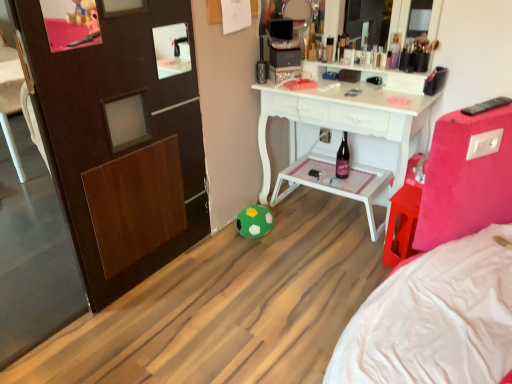
Question: Can you confirm if metallic silver toiletry at center, the first toiletry from the left, is thinner than metallic silver toiletries at upper center, which appears as the 2th toiletry when viewed from the left?

Choices:
 (A) yes
 (B) no

Answer: (A)

Question: Is metallic silver toiletry at center, the first toiletry from the left, facing away from metallic silver toiletries at upper center, placed as the 1th toiletry when sorted from right to left?

Choices:
 (A) no
 (B) yes

Answer: (A)

Question: Considering the relative sizes of metallic silver toiletry at center, acting as the second toiletry starting from the right, and metallic silver toiletries at upper center, which appears as the 2th toiletry when viewed from the left, in the image provided, is metallic silver toiletry at center, acting as the second toiletry starting from the right, smaller than metallic silver toiletries at upper center, which appears as the 2th toiletry when viewed from the left,?

Choices:
 (A) yes
 (B) no

Answer: (A)

Question: From the image's perspective, is metallic silver toiletry at center, the first toiletry from the left, on top of metallic silver toiletries at upper center, which appears as the 2th toiletry when viewed from the left?

Choices:
 (A) no
 (B) yes

Answer: (A)

Question: Is metallic silver toiletries at upper center, which appears as the 2th toiletry when viewed from the left, surrounded by metallic silver toiletry at center, acting as the second toiletry starting from the right?

Choices:
 (A) yes
 (B) no

Answer: (B)

Question: Is black plastic remote control at upper right bigger or smaller than dark glass bottle at center?

Choices:
 (A) small
 (B) big

Answer: (A)

Question: From their relative heights in the image, would you say black plastic remote control at upper right is taller or shorter than dark glass bottle at center?

Choices:
 (A) short
 (B) tall

Answer: (A)

Question: From a real-world perspective, is black plastic remote control at upper right positioned above or below dark glass bottle at center?

Choices:
 (A) below
 (B) above

Answer: (B)

Question: Is point (503, 104) closer or farther from the camera than point (340, 153)?

Choices:
 (A) closer
 (B) farther

Answer: (A)

Question: Based on their positions, is metallic silver toiletry at center, acting as the second toiletry starting from the right, located to the left or right of green felt ball at lower center?

Choices:
 (A) left
 (B) right

Answer: (B)

Question: Is metallic silver toiletry at center, acting as the second toiletry starting from the right, inside or outside of green felt ball at lower center?

Choices:
 (A) inside
 (B) outside

Answer: (B)

Question: Relative to green felt ball at lower center, is metallic silver toiletry at center, the first toiletry from the left, in front or behind?

Choices:
 (A) front
 (B) behind

Answer: (B)

Question: From the image's perspective, is metallic silver toiletry at center, the first toiletry from the left, located above or below green felt ball at lower center?

Choices:
 (A) below
 (B) above

Answer: (B)

Question: In terms of height, does black plastic remote control at upper right look taller or shorter compared to white plastic tray at center?

Choices:
 (A) short
 (B) tall

Answer: (A)

Question: From the image's perspective, relative to white plastic tray at center, is black plastic remote control at upper right above or below?

Choices:
 (A) below
 (B) above

Answer: (B)